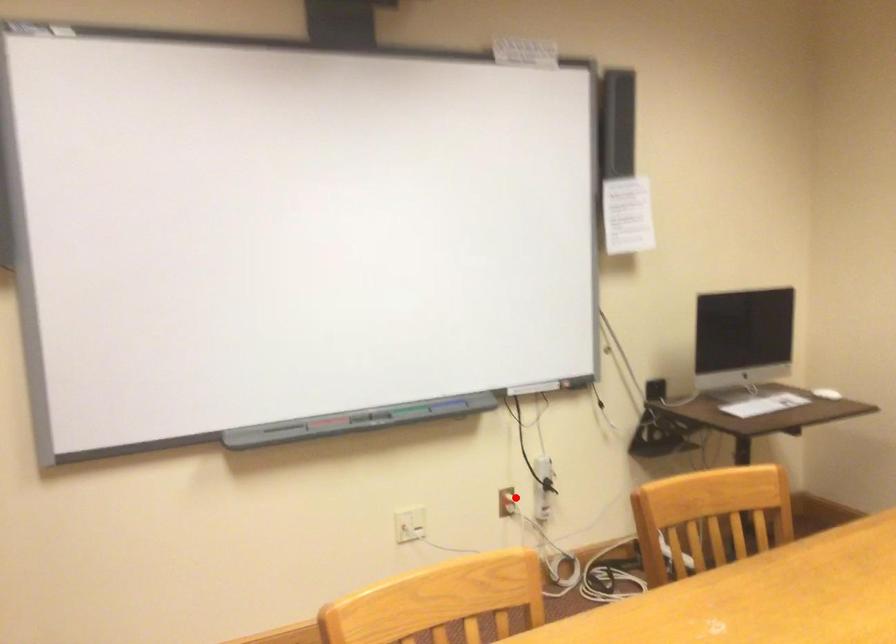
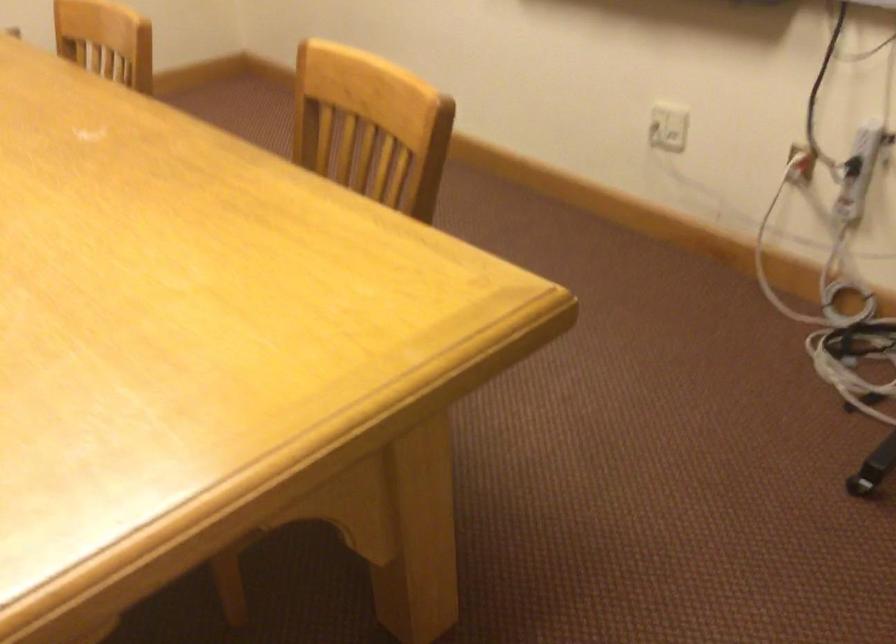
In the second image, find the point that corresponds to the highlighted location in the first image.

(800, 164)